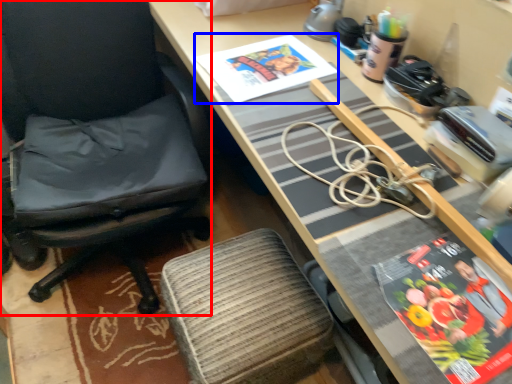
Question: Which of the following is the closest to the observer, chair (highlighted by a red box) or book cover (highlighted by a blue box)?

Choices:
 (A) chair
 (B) book cover

Answer: (A)